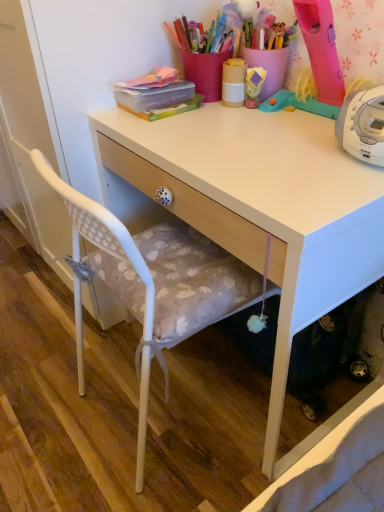
The height and width of the screenshot is (512, 384). What do you see at coordinates (233, 82) in the screenshot? I see `matte yellow cup at upper center` at bounding box center [233, 82].

Locate an element on the screen. The image size is (384, 512). white matte desk at center is located at coordinates (260, 212).

What are the coordinates of `matte yellow cup at upper center` in the screenshot? It's located at (233, 82).

Who is smaller, white plastic chair at left or matte yellow cup at upper center?

matte yellow cup at upper center is smaller.

Is point (219, 293) closer or farther from the camera than point (238, 71)?

Clearly, point (219, 293) is closer to the camera than point (238, 71).

Is white plastic chair at left far from matte yellow cup at upper center?

No, white plastic chair at left is not far from matte yellow cup at upper center.

How much distance is there between white plastic chair at left and matte yellow cup at upper center?

white plastic chair at left and matte yellow cup at upper center are 21.76 inches apart.

Is matte yellow cup at upper center in contact with white plastic chair at left?

matte yellow cup at upper center and white plastic chair at left are clearly separated.

Is white plastic chair at left a part of matte yellow cup at upper center?

That's incorrect, white plastic chair at left is not inside matte yellow cup at upper center.

Is matte yellow cup at upper center bigger or smaller than white plastic chair at left?

Clearly, matte yellow cup at upper center is smaller in size than white plastic chair at left.

Locate an element on the screen. The image size is (384, 512). office supplies on the right of white plastic chair at left is located at coordinates (233, 82).

Is matte yellow cup at upper center behind white matte desk at center?

Yes, matte yellow cup at upper center is further from the viewer.

Can we say matte yellow cup at upper center lies outside white matte desk at center?

Yes, matte yellow cup at upper center is outside of white matte desk at center.

In the scene shown: Which of these two, matte yellow cup at upper center or white matte desk at center, stands taller?

white matte desk at center is taller.

Considering the relative positions of white matte desk at center and matte yellow cup at upper center in the image provided, is white matte desk at center to the right of matte yellow cup at upper center from the viewer's perspective?

Correct, you'll find white matte desk at center to the right of matte yellow cup at upper center.

Which object is wider, white matte desk at center or matte yellow cup at upper center?

white matte desk at center.

Is white matte desk at center situated inside matte yellow cup at upper center or outside?

The correct answer is: outside.

Who is taller, white matte desk at center or matte yellow cup at upper center?

white matte desk at center.

Which point is more forward, (171, 187) or (209, 316)?

The point (209, 316) is closer to the camera.

From the picture: Considering the sizes of white matte desk at center and white plastic chair at left in the image, is white matte desk at center wider or thinner than white plastic chair at left?

In the image, white matte desk at center appears to be wider than white plastic chair at left.

From the image's perspective, which is above, white matte desk at center or white plastic chair at left?

white matte desk at center appears higher in the image.

How much distance is there between white matte desk at center and white plastic chair at left?

white matte desk at center and white plastic chair at left are 8.48 inches apart.

Based on the photo, which is closer, (150, 317) or (128, 123)?

Point (150, 317) is closer to the camera than point (128, 123).

Who is smaller, white plastic chair at left or white matte desk at center?

Smaller between the two is white plastic chair at left.

Is white plastic chair at left surrounding white matte desk at center?

No, white matte desk at center is not surrounded by white plastic chair at left.

Considering the positions of objects white plastic chair at left and white matte desk at center in the image provided, who is in front, white plastic chair at left or white matte desk at center?

white plastic chair at left is closer to the camera.

Identify the location of chair that appears below the matte yellow cup at upper center (from the image's perspective). (152, 283).

What are the coordinates of `office supplies located on the right of white plastic chair at left` in the screenshot? It's located at (233, 82).

When comparing their distances from matte yellow cup at upper center, does white matte desk at center or white plastic chair at left seem further?

white plastic chair at left is positioned further to the anchor matte yellow cup at upper center.

Looking at this image, when comparing their distances from matte yellow cup at upper center, does white plastic chair at left or white matte desk at center seem closer?

Based on the image, white matte desk at center appears to be nearer to matte yellow cup at upper center.

Considering their positions, is white plastic chair at left positioned closer to white matte desk at center than matte yellow cup at upper center?

Among the two, white plastic chair at left is located nearer to white matte desk at center.

When comparing their distances from white matte desk at center, does matte yellow cup at upper center or white plastic chair at left seem closer?

white plastic chair at left is positioned closer to the anchor white matte desk at center.

Considering their positions, is white matte desk at center positioned further to white plastic chair at left than matte yellow cup at upper center?

matte yellow cup at upper center.

Based on their spatial positions, is matte yellow cup at upper center or white matte desk at center closer to white plastic chair at left?

Based on the image, white matte desk at center appears to be nearer to white plastic chair at left.

The image size is (384, 512). I want to click on desk between matte yellow cup at upper center and white plastic chair at left in the vertical direction, so click(260, 212).